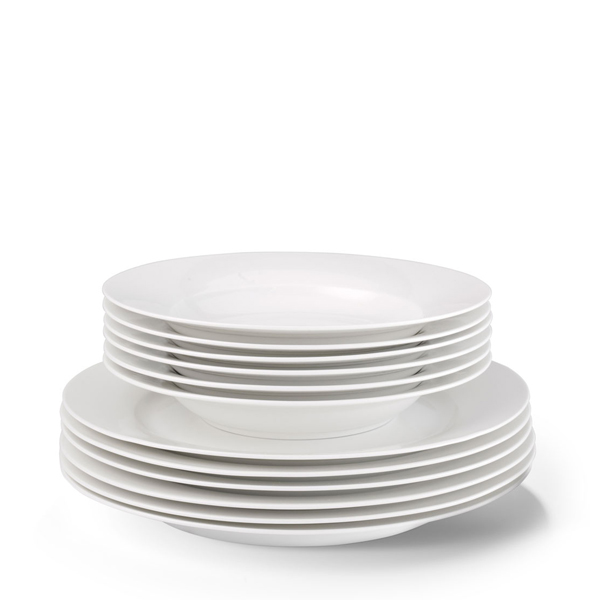
You are a GUI agent. You are given a task and a screenshot of the screen. Output one action in this format:
    pyautogui.click(x=<x>, y=<y>)
    Task: Click on the plates
    
    Given the screenshot: What is the action you would take?
    pyautogui.click(x=301, y=457), pyautogui.click(x=301, y=475), pyautogui.click(x=300, y=489), pyautogui.click(x=300, y=505), pyautogui.click(x=300, y=519), pyautogui.click(x=300, y=535)